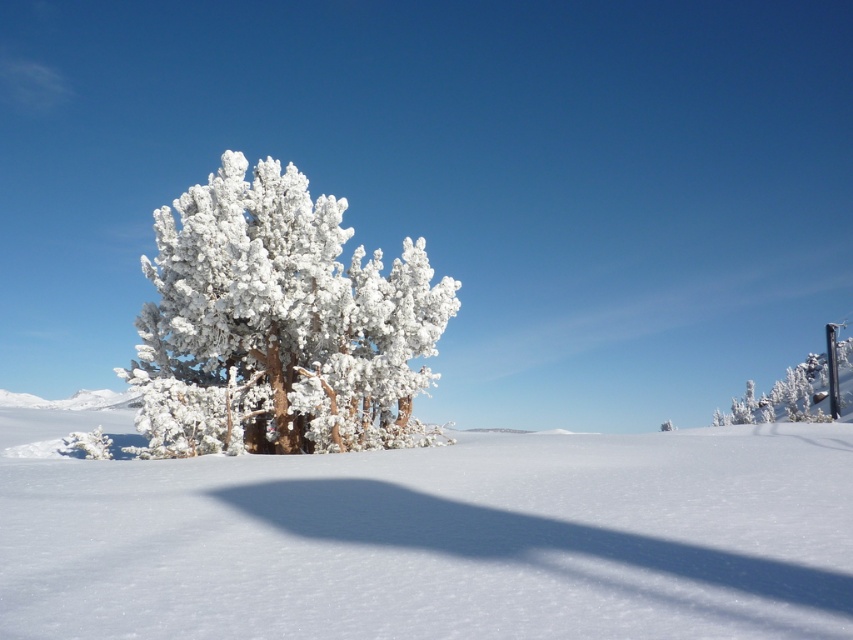
Is frosted white tree at center bigger than white frosty tree at upper right?

Actually, frosted white tree at center might be smaller than white frosty tree at upper right.

Measure the distance between point (x=392, y=278) and camera.

Point (x=392, y=278) is 20.57 meters from camera.

Where is `frosted white tree at center`? The height and width of the screenshot is (640, 853). frosted white tree at center is located at coordinates (279, 324).

Can you confirm if white frosty tree at center is positioned to the right of white frosty tree at upper right?

In fact, white frosty tree at center is to the left of white frosty tree at upper right.

Locate an element on the screen. The image size is (853, 640). white frosty tree at center is located at coordinates (440, 540).

Can you confirm if white frosty tree at center is shorter than frosted white tree at center?

Yes, white frosty tree at center is shorter than frosted white tree at center.

Locate an element on the screen. white frosty tree at center is located at coordinates (440, 540).

Which is behind, point (827, 525) or point (131, 372)?

The point (131, 372) is behind.

What are the coordinates of `white frosty tree at center` in the screenshot? It's located at (440, 540).